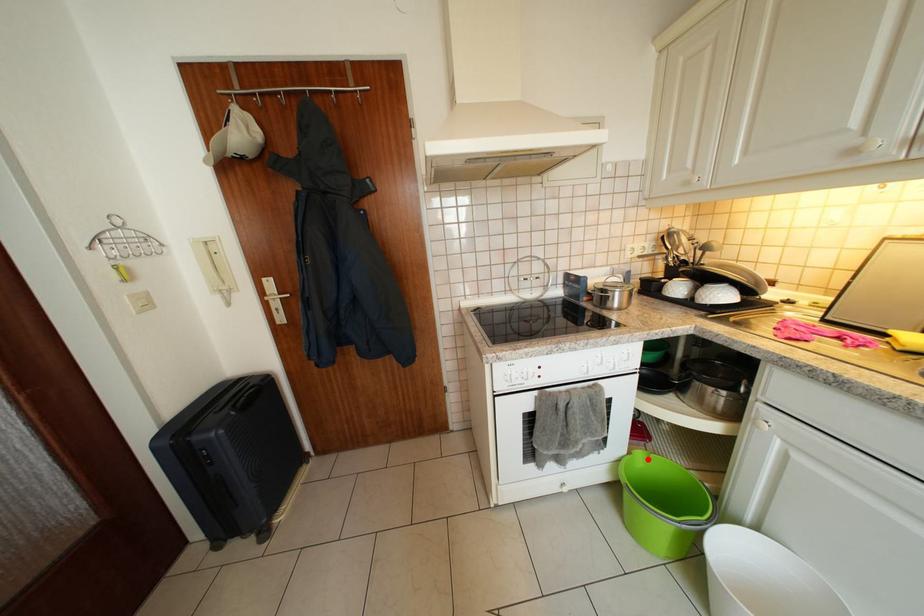
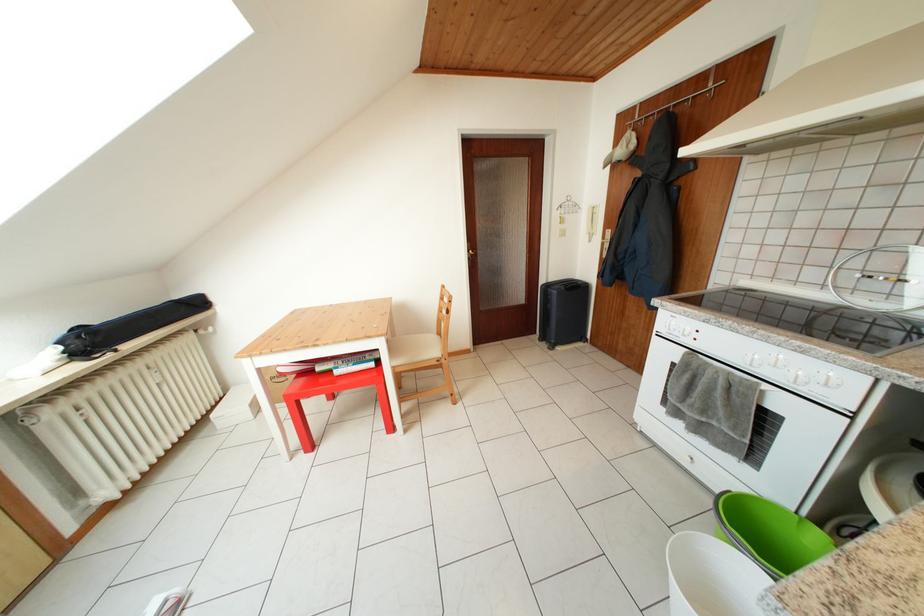
Question: I am providing you with two images of the same scene from different viewpoints. A red point is marked on the first image. Is the red point's position out of view in image 2?

Choices:
 (A) Yes
 (B) No

Answer: (B)